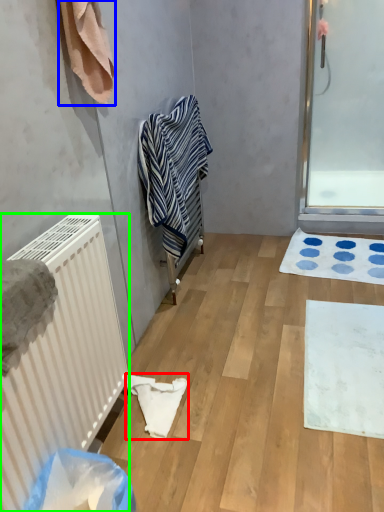
Question: Estimate the real-world distances between objects in this image. Which object is farther from material (highlighted by a red box), towel (highlighted by a blue box) or radiator (highlighted by a green box)?

Choices:
 (A) towel
 (B) radiator

Answer: (A)